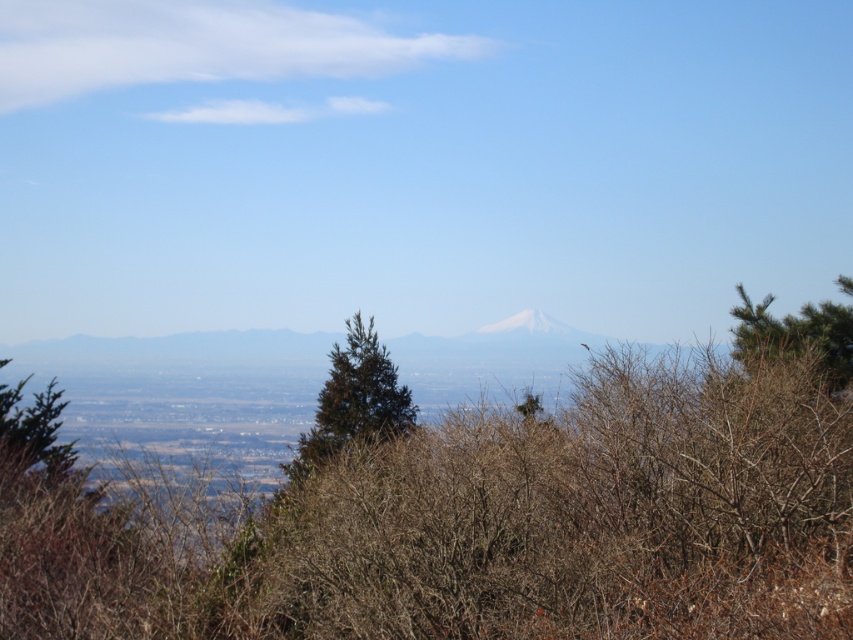
Question: Which object is the farthest from the green textured pine tree at center?

Choices:
 (A) brown textured tree at left
 (B) white snow-capped peak at center
 (C) green needle-like tree at right

Answer: (B)

Question: Considering the relative positions of brown textured tree at left and white snow-capped peak at center in the image provided, where is brown textured tree at left located with respect to white snow-capped peak at center?

Choices:
 (A) below
 (B) above

Answer: (A)

Question: Which point is farther from the camera taking this photo?

Choices:
 (A) (16, 424)
 (B) (817, 346)

Answer: (A)

Question: Where is green textured pine tree at center located in relation to green needle-like tree at right in the image?

Choices:
 (A) above
 (B) below

Answer: (B)

Question: Among these objects, which one is farthest from the camera?

Choices:
 (A) green textured pine tree at center
 (B) brown textured tree at left

Answer: (B)

Question: Is green textured pine tree at center bigger than white snow-capped peak at center?

Choices:
 (A) no
 (B) yes

Answer: (B)